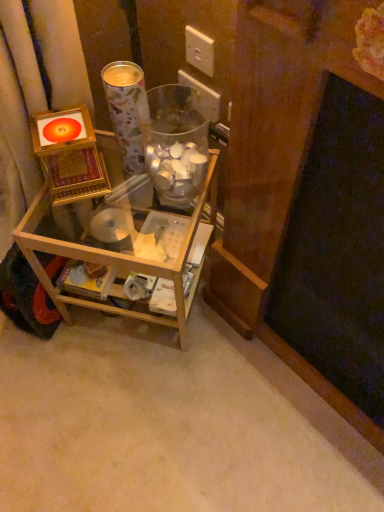
Question: Considering the positions of white plastic electric outlet at upper center, the second electric outlet when ordered from front to back, and metallic paper cup at upper center in the image, is white plastic electric outlet at upper center, the second electric outlet when ordered from front to back, wider or thinner than metallic paper cup at upper center?

Choices:
 (A) wide
 (B) thin

Answer: (B)

Question: Considering the relative positions of white plastic electric outlet at upper center, the second electric outlet when ordered from front to back, and metallic paper cup at upper center in the image provided, is white plastic electric outlet at upper center, the second electric outlet when ordered from front to back, to the left or to the right of metallic paper cup at upper center?

Choices:
 (A) left
 (B) right

Answer: (B)

Question: Considering the real-world distances, which object is closest to the metallic paper cup at upper center?

Choices:
 (A) white plastic electric outlet at upper center, marked as the first electric outlet in a front-to-back arrangement
 (B) white plastic electric outlet at upper center, acting as the 1th electric outlet starting from the back
 (C) transparent glass jar at center
 (D) clear wood shelf at center

Answer: (C)

Question: Based on their relative distances, which object is nearer to the metallic paper cup at upper center?

Choices:
 (A) white plastic electric outlet at upper center, marked as the first electric outlet in a front-to-back arrangement
 (B) white plastic electric outlet at upper center, the second electric outlet when ordered from front to back
 (C) transparent glass jar at center
 (D) clear wood shelf at center

Answer: (C)